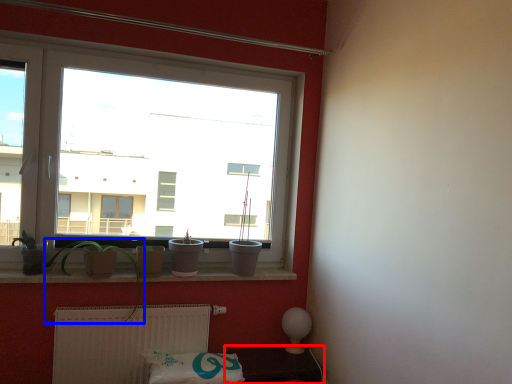
Question: Which object is closer to the camera taking this photo, furniture (highlighted by a red box) or plant (highlighted by a blue box)?

Choices:
 (A) furniture
 (B) plant

Answer: (B)